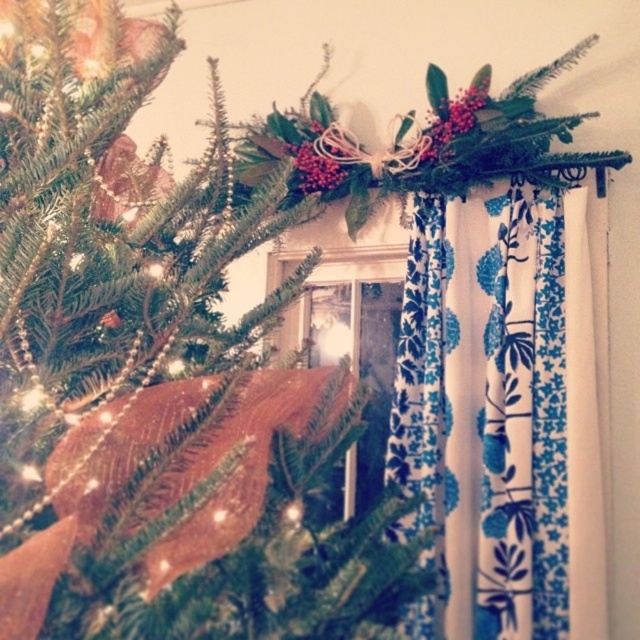
The image size is (640, 640). What do you see at coordinates (157, 385) in the screenshot? I see `green matte christmas tree at upper left` at bounding box center [157, 385].

Is green matte christmas tree at upper left above blue floral fabric curtain at upper center?

Correct, green matte christmas tree at upper left is located above blue floral fabric curtain at upper center.

This screenshot has height=640, width=640. What do you see at coordinates (157, 385) in the screenshot? I see `green matte christmas tree at upper left` at bounding box center [157, 385].

Where is `green matte christmas tree at upper left`? green matte christmas tree at upper left is located at coordinates (157, 385).